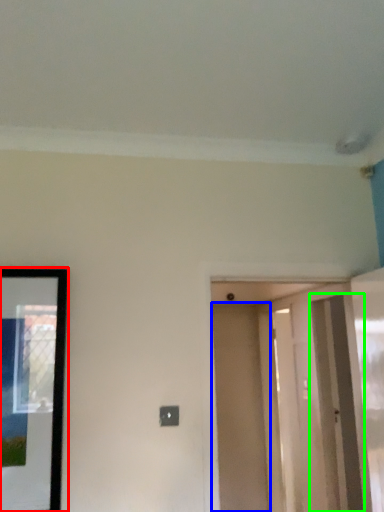
Question: Considering the real-world distances, which object is farthest from picture frame (highlighted by a red box)? door (highlighted by a blue box) or screen door (highlighted by a green box)?

Choices:
 (A) door
 (B) screen door

Answer: (A)